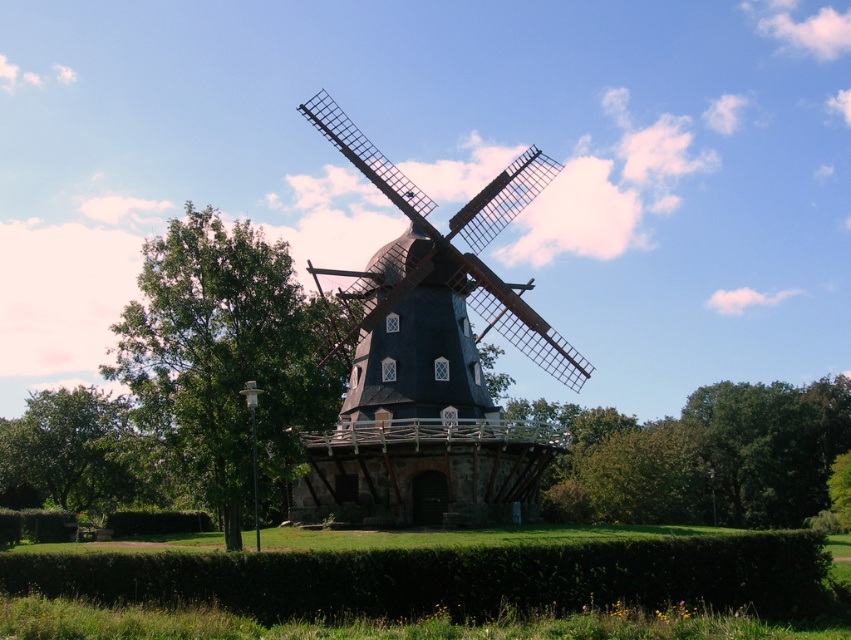
Question: Which point appears farthest from the camera in this image?

Choices:
 (A) (690, 556)
 (B) (60, 403)

Answer: (B)

Question: In this image, where is dark gray wooden windmill at center located relative to green leafy tree at center?

Choices:
 (A) left
 (B) right

Answer: (A)

Question: Can you confirm if green leafy tree at left is positioned below green leafy tree at center?

Choices:
 (A) yes
 (B) no

Answer: (B)

Question: Considering the real-world distances, which object is closest to the green leafy tree at lower left?

Choices:
 (A) green leafy tree at left
 (B) dark gray wooden windmill at center
 (C) green leafy tree at center
 (D) green leafy hedge at lower center

Answer: (A)

Question: Which of the following is the farthest from the observer?

Choices:
 (A) green leafy tree at lower left
 (B) green leafy tree at left
 (C) green leafy hedge at lower center

Answer: (A)

Question: Can you confirm if green leafy tree at left is thinner than green leafy tree at center?

Choices:
 (A) no
 (B) yes

Answer: (B)